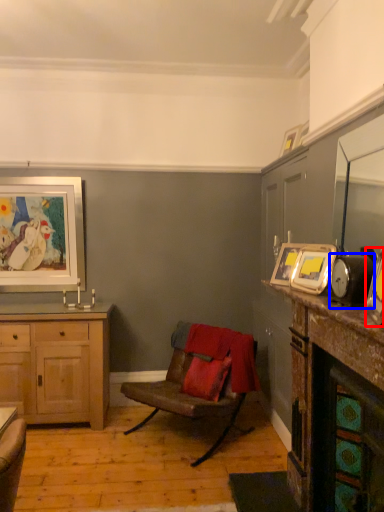
Question: Which of the following is the farthest to the observer, picture frame (highlighted by a red box) or alarm clock (highlighted by a blue box)?

Choices:
 (A) picture frame
 (B) alarm clock

Answer: (B)